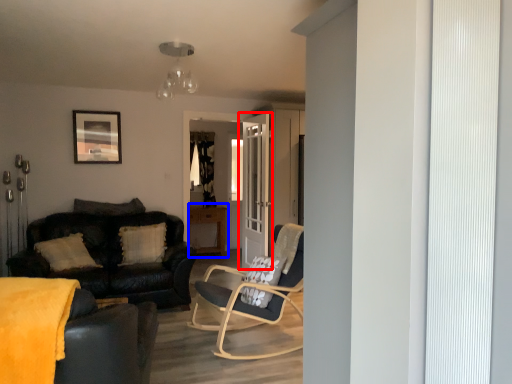
Question: Which object is closer to the camera taking this photo, door (highlighted by a red box) or table (highlighted by a blue box)?

Choices:
 (A) door
 (B) table

Answer: (A)